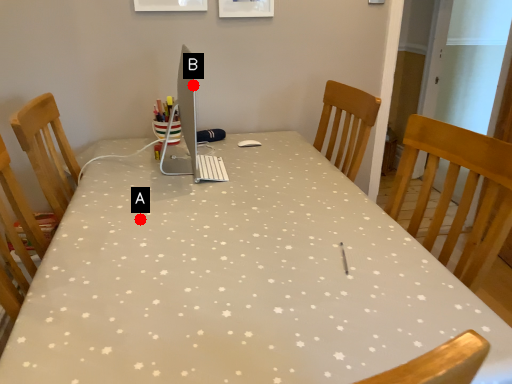
Question: Two points are circled on the image, labeled by A and B beside each circle. Among these points, which one is farthest from the camera?

Choices:
 (A) A is further
 (B) B is further

Answer: (B)